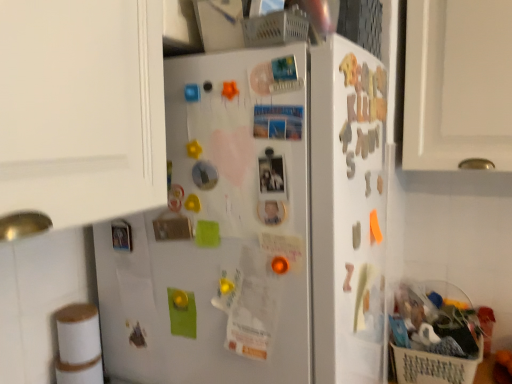
Question: Is point (234, 82) closer or farther from the camera than point (373, 195)?

Choices:
 (A) farther
 (B) closer

Answer: (B)

Question: Is orange matte magnet at upper center, the eighth magnet in the right-to-left sequence, to the left or to the right of white matte refrigerator at center in the image?

Choices:
 (A) left
 (B) right

Answer: (A)

Question: Which object is positioned farthest from the plastic shopping basket at lower right?

Choices:
 (A) orange matte magnet at upper center, which appears as the 6th magnet when viewed from the left
 (B) metallic silver magnet at center, acting as the 12th magnet starting from the right
 (C) blue plastic magnet at upper center, which is the third magnet from left to right
 (D) yellow rubber at upper center, which is the tenth magnet from right to left
 (E) orange glossy magnet at center, which is the 7th magnet in left-to-right order

Answer: (C)

Question: Estimate the real-world distances between objects in this image. Which object is closer to the metallic silver magnet at center, acting as the 12th magnet starting from the right?

Choices:
 (A) plastic shopping basket at lower right
 (B) matte plastic photo at center, which appears as the second button when viewed from the top
 (C) orange glossy magnet at center, which is the 7th magnet in left-to-right order
 (D) orange matte letter s at upper right, which ranks as the tenth magnet in left-to-right order
 (E) yellow rubber at upper center, arranged as the 4th magnet when viewed from the left

Answer: (E)